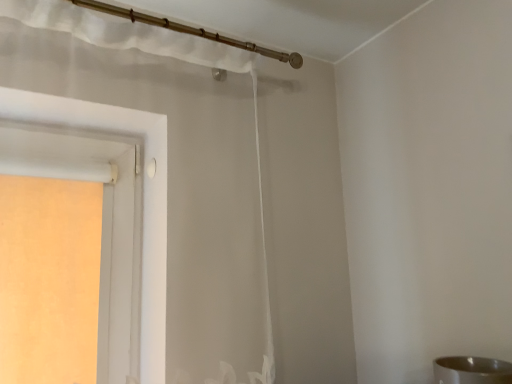
Question: Would you say silver metallic sink at lower right is to the left or to the right of sheer white curtain at upper center in the picture?

Choices:
 (A) left
 (B) right

Answer: (B)

Question: In terms of size, does silver metallic sink at lower right appear bigger or smaller than sheer white curtain at upper center?

Choices:
 (A) small
 (B) big

Answer: (A)

Question: Considering the positions of point (498, 377) and point (151, 21), is point (498, 377) closer or farther from the camera than point (151, 21)?

Choices:
 (A) closer
 (B) farther

Answer: (A)

Question: Which is correct: sheer white curtain at upper center is inside silver metallic sink at lower right, or outside of it?

Choices:
 (A) inside
 (B) outside

Answer: (B)

Question: From the image's perspective, is sheer white curtain at upper center above or below silver metallic sink at lower right?

Choices:
 (A) below
 (B) above

Answer: (B)

Question: In terms of size, does sheer white curtain at upper center appear bigger or smaller than silver metallic sink at lower right?

Choices:
 (A) big
 (B) small

Answer: (A)

Question: From a real-world perspective, is sheer white curtain at upper center positioned above or below silver metallic sink at lower right?

Choices:
 (A) below
 (B) above

Answer: (B)